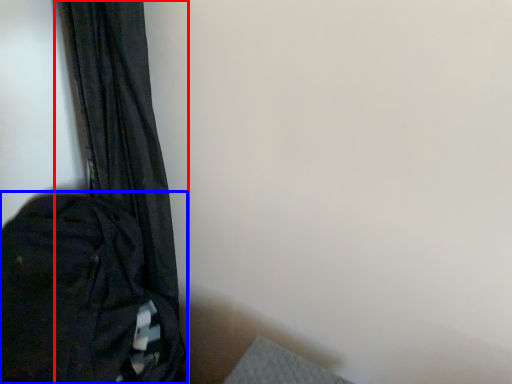
Question: Which object is closer to the camera taking this photo, curtain (highlighted by a red box) or backpack (highlighted by a blue box)?

Choices:
 (A) curtain
 (B) backpack

Answer: (B)